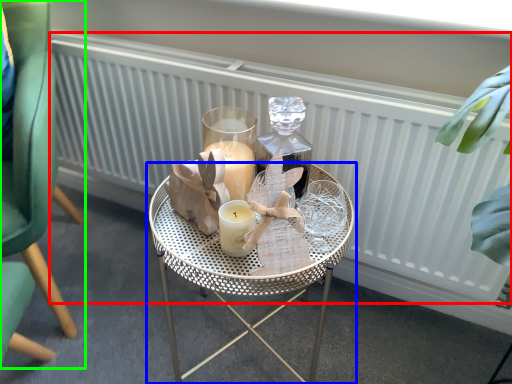
Question: Based on their relative distances, which object is nearer to radiator (highlighted by a red box)? Choose from table (highlighted by a blue box) and chair (highlighted by a green box).

Choices:
 (A) table
 (B) chair

Answer: (A)